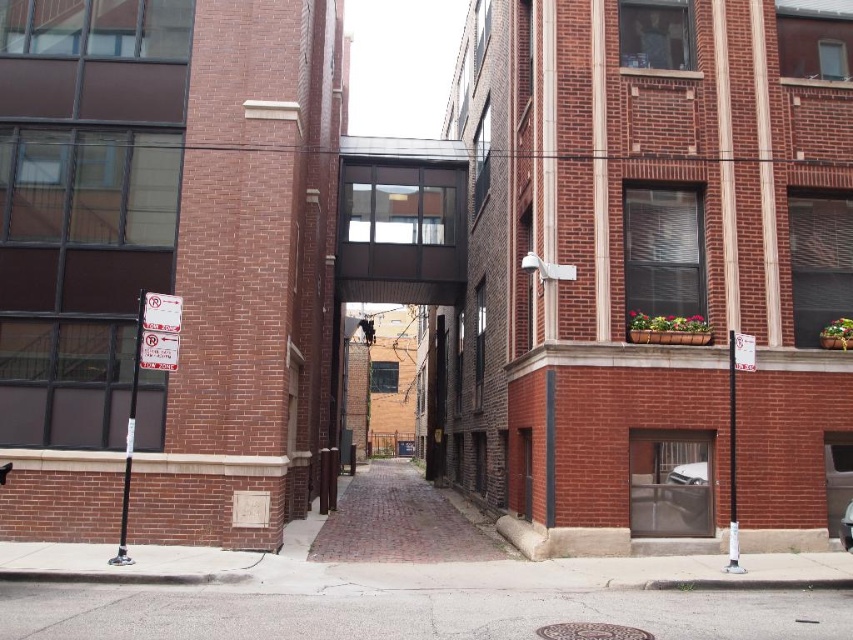
You are driving a metallic silver car at center and want to park it in the alleyway. There is a white plastic sign at left blocking your path. Can you move the car past the sign to park further ahead?

The metallic silver car at center is behind white plastic sign at left, so you can move the car past the sign to park further ahead since the car is positioned behind it and can maneuver around or in front of the sign.

You are a delivery person trying to park your 2.5 meter long bike. You see the gray asphalt at lower center and the brick pavement at center. Which area can accommodate your bike without it overhanging?

The brick pavement at center can accommodate the bike since it is longer than the gray asphalt at lower center, which is shorter and may not provide enough space for the bike to fit entirely without overhanging.